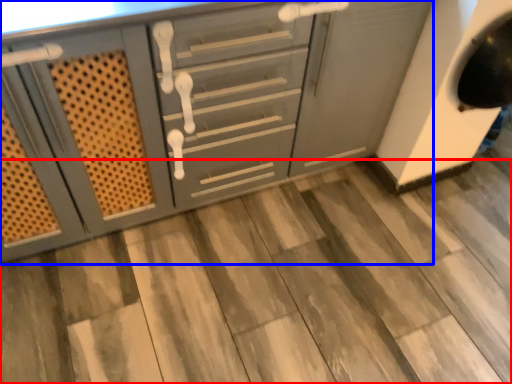
Question: Which object appears closest to the camera in this image, tile (highlighted by a red box) or cabinetry (highlighted by a blue box)?

Choices:
 (A) tile
 (B) cabinetry

Answer: (B)